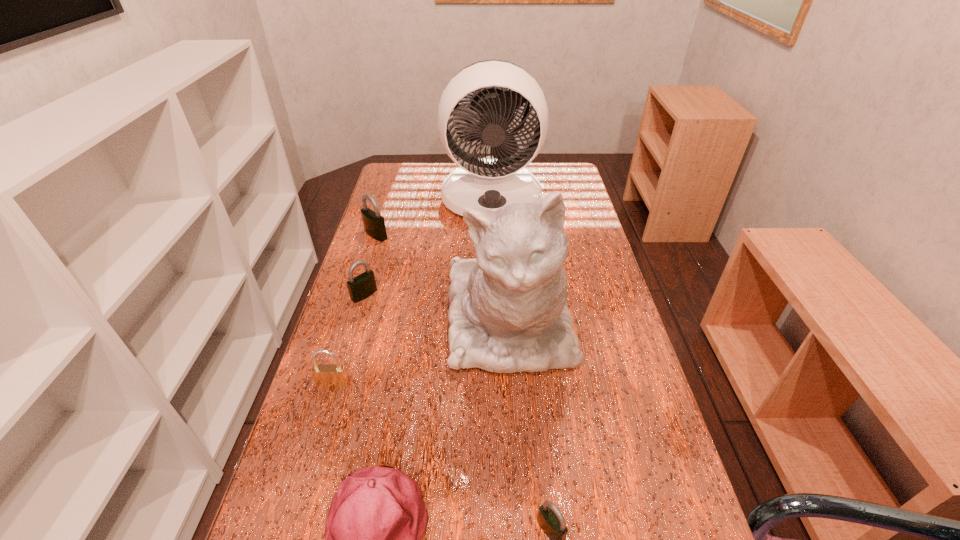
Locate an element on the screen. This screenshot has height=540, width=960. free point located 0.110m on the back of the second farthest object is located at coordinates (383, 210).

In order to click on vacant space located on the back of the second farthest black padlock in this screenshot , I will do tap(378, 247).

Find the location of a particular element. free location located 0.180m on the front-facing side of the brass padlock is located at coordinates (309, 465).

The image size is (960, 540). In order to click on object at the far edge in this screenshot , I will do `click(500, 179)`.

This screenshot has height=540, width=960. I want to click on fan that is at the right edge, so click(x=500, y=179).

In order to click on cat positioned at the right edge in this screenshot , I will do `click(508, 313)`.

Image resolution: width=960 pixels, height=540 pixels. In order to click on object that is at the far right corner in this screenshot , I will do `click(500, 179)`.

Find the location of a particular element. vacant space at the far edge of the desktop is located at coordinates (436, 185).

Identify the location of free space at the left edge. The height and width of the screenshot is (540, 960). (377, 262).

In the image, there is a desktop. Where is `vacant area at the right edge`? vacant area at the right edge is located at coordinates (578, 198).